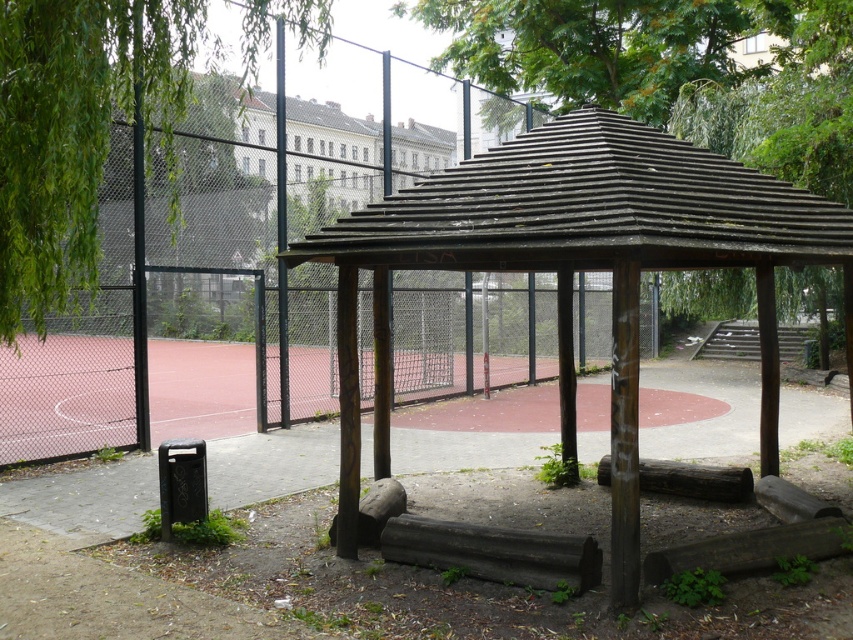
Question: Does weathered wood gazebo at center appear on the left side of green leafy tree at left?

Choices:
 (A) no
 (B) yes

Answer: (A)

Question: Among these points, which one is nearest to the camera?

Choices:
 (A) (566, 284)
 (B) (51, 38)

Answer: (B)

Question: Among these points, which one is nearest to the camera?

Choices:
 (A) (650, 184)
 (B) (171, 12)

Answer: (A)

Question: Can you confirm if weathered wood gazebo at center is positioned below green leafy tree at left?

Choices:
 (A) no
 (B) yes

Answer: (B)

Question: Is weathered wood gazebo at center to the right of green leafy tree at left from the viewer's perspective?

Choices:
 (A) yes
 (B) no

Answer: (A)